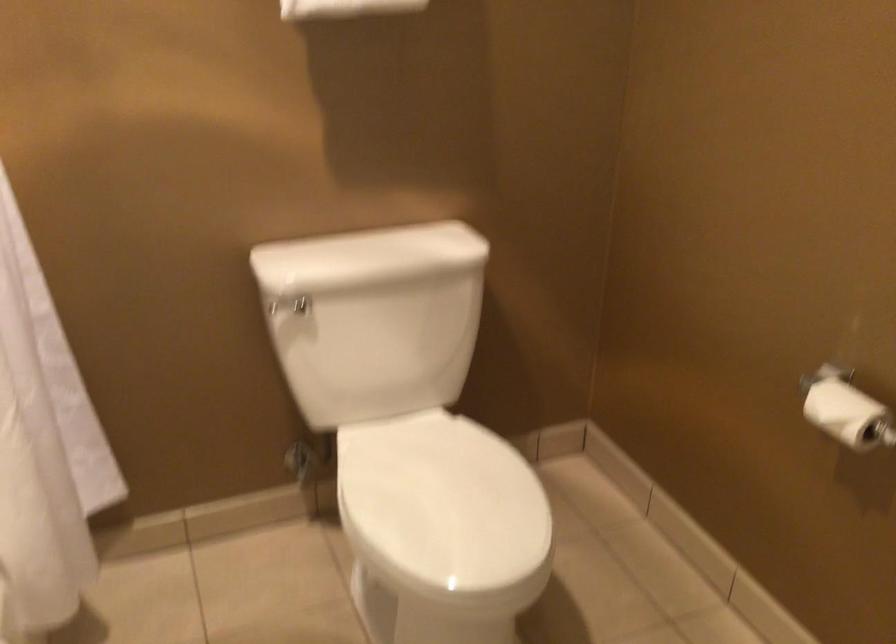
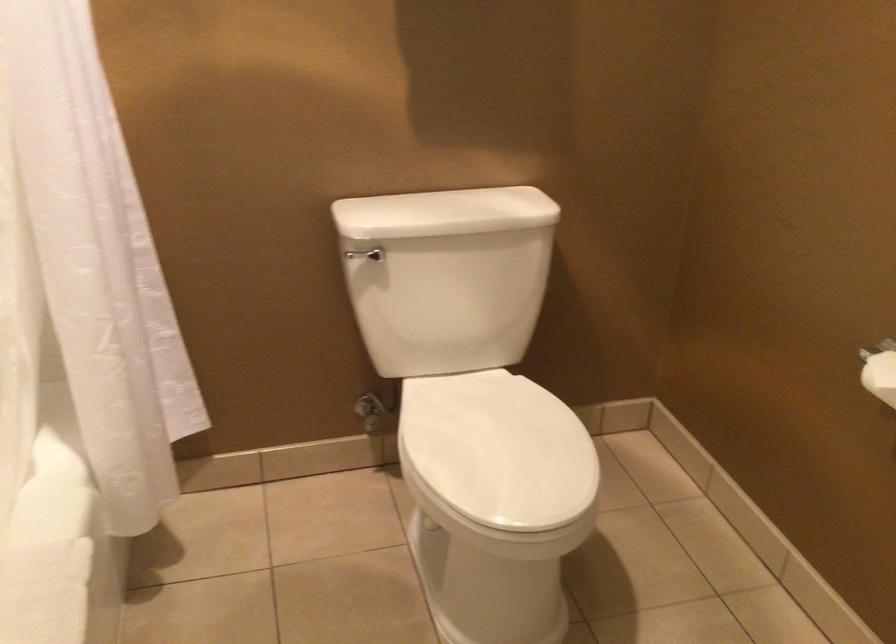
Locate, in the second image, the point that corresponds to point (302, 464) in the first image.

(371, 412)